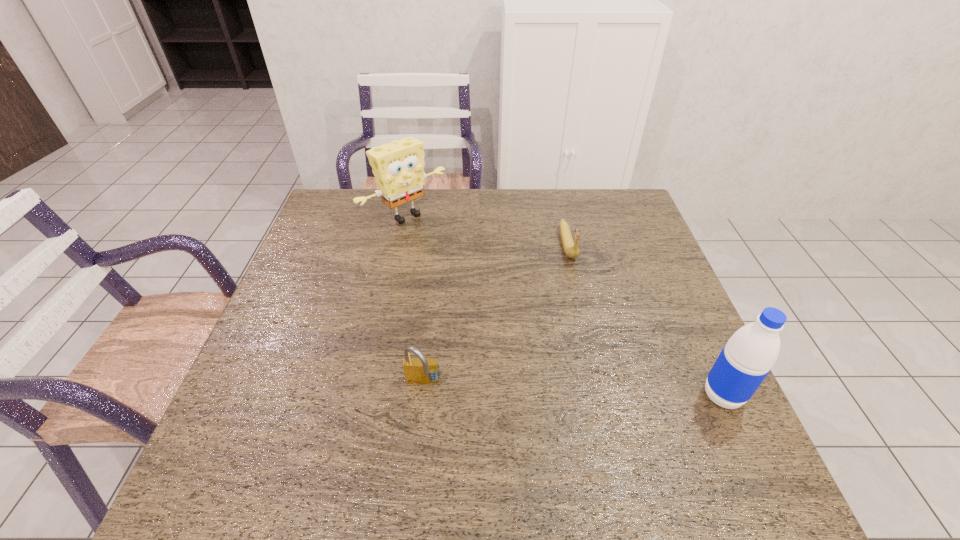
Where is `vacant space that's between the second object from right to left and the padlock`? This screenshot has height=540, width=960. vacant space that's between the second object from right to left and the padlock is located at coordinates (495, 314).

Locate an element on the screen. Image resolution: width=960 pixels, height=540 pixels. vacant area between the sponge and the padlock is located at coordinates (415, 300).

Locate an element on the screen. This screenshot has height=540, width=960. unoccupied area between the sponge and the padlock is located at coordinates (415, 300).

You are a GUI agent. You are given a task and a screenshot of the screen. Output one action in this format:
    pyautogui.click(x=<x>, y=<y>)
    Task: Click on the vacant point located between the sponge and the padlock
    
    Given the screenshot: What is the action you would take?
    pyautogui.click(x=415, y=300)

Locate an element on the screen. free space between the second object from right to left and the sponge is located at coordinates (487, 230).

Find the location of a particular element. The image size is (960, 540). free spot between the padlock and the sponge is located at coordinates (415, 300).

Image resolution: width=960 pixels, height=540 pixels. I want to click on object identified as the second closest to the banana, so click(x=749, y=355).

Select which object appears as the third closest to the third object from left to right. Please provide its 2D coordinates. Your answer should be formatted as a tuple, i.e. [(x, y)], where the tuple contains the x and y coordinates of a point satisfying the conditions above.

[(421, 370)]

Where is `vacant position in the image that satisfies the following two spatial constraints: 1. on the front side of the water bottle; 2. on the left side of the sponge`? vacant position in the image that satisfies the following two spatial constraints: 1. on the front side of the water bottle; 2. on the left side of the sponge is located at coordinates (368, 395).

Find the location of `free region that satisfies the following two spatial constraints: 1. on the side with the combination dials of the padlock; 2. on the right side of the rightmost object`. free region that satisfies the following two spatial constraints: 1. on the side with the combination dials of the padlock; 2. on the right side of the rightmost object is located at coordinates (422, 395).